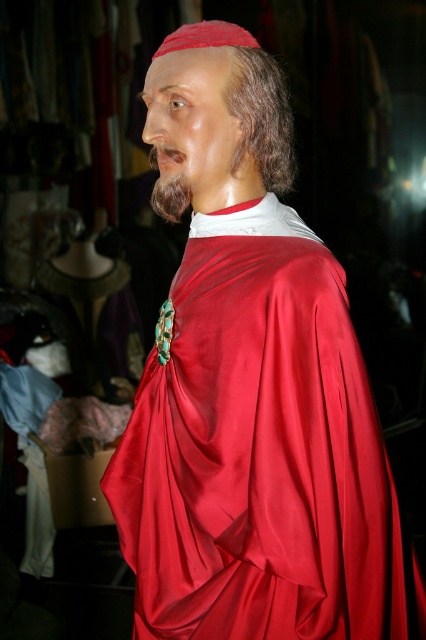
You are an artist sketching the figure in the image. You need to place the dark brown silky hair at upper center in your drawing. What are the coordinates for its position?

The dark brown silky hair at upper center should be placed at coordinates 0.183 on the x axis and 0.615 on the y axis.

You are an artist sketching this figure. You want to draw the brown fuzzy beard at center before the satin red robe at center. Is this possible without overlapping?

The satin red robe at center is below the brown fuzzy beard at center, so yes, you can draw the brown fuzzy beard at center first since it is positioned above the robe and won

You are a costume designer preparing to create a replica of the figure in the image. You need to determine which of the two items, the satin red robe at center or the brown fuzzy beard at center, requires more fabric in terms of material quantity. Based on the description, which one would need more fabric?

The satin red robe at center requires more fabric because its width is larger than the brown fuzzy beard at center, indicating it covers a greater area.